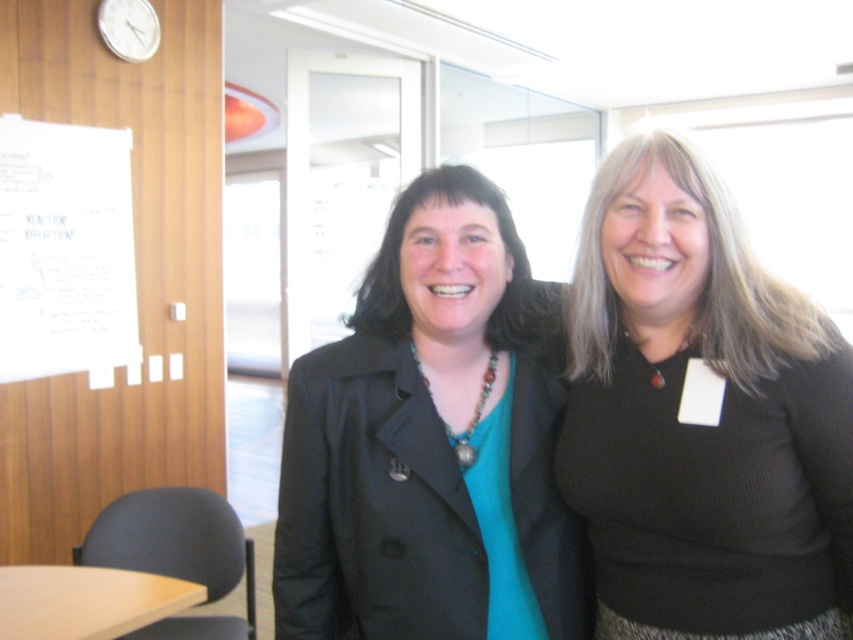
Question: Is matte black jacket at center bigger than white paper at upper left?

Choices:
 (A) yes
 (B) no

Answer: (B)

Question: Does matte black jacket at center have a lesser width compared to white paper at upper left?

Choices:
 (A) no
 (B) yes

Answer: (A)

Question: Which of these objects is positioned closest to the matte black jacket at center?

Choices:
 (A) black ribbed sweater at right
 (B) white paper at upper left

Answer: (A)

Question: Can you confirm if black ribbed sweater at right is positioned to the right of matte black jacket at center?

Choices:
 (A) yes
 (B) no

Answer: (A)

Question: Which object is the farthest from the white paper at upper left?

Choices:
 (A) black ribbed sweater at right
 (B) matte black jacket at center

Answer: (A)

Question: Considering the real-world distances, which object is closest to the matte black jacket at center?

Choices:
 (A) black ribbed sweater at right
 (B) white paper at upper left

Answer: (A)